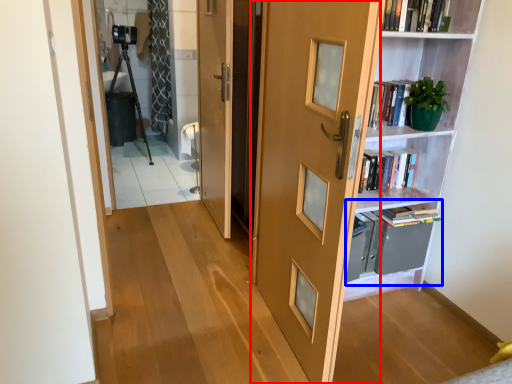
Question: Which object appears farthest to the camera in this image, door (highlighted by a red box) or cabinet (highlighted by a blue box)?

Choices:
 (A) door
 (B) cabinet

Answer: (B)